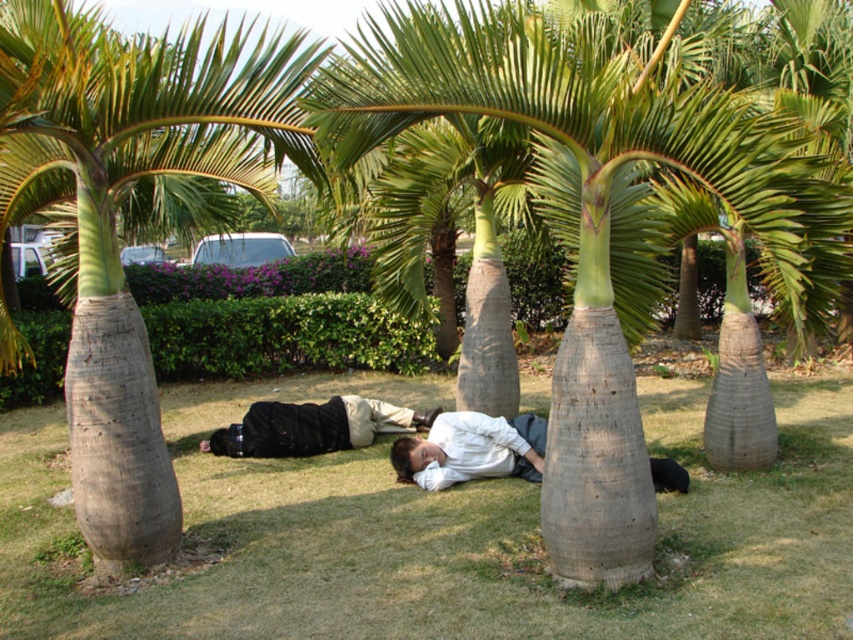
Describe the element at coordinates (590, 212) in the screenshot. I see `smooth gray trunk at center` at that location.

Is point (514, 113) positioned before point (252, 108)?

Yes, point (514, 113) is closer to viewer.

Find the location of `smooth gray trunk at center`. smooth gray trunk at center is located at coordinates (590, 212).

Identify the location of smooth gray trunk at center. This screenshot has height=640, width=853. (590, 212).

Can you confirm if green grass at center is taller than smooth gray trunk at center?

No, green grass at center is not taller than smooth gray trunk at center.

Is point (194, 586) positioned behind point (730, 138)?

Yes, it is.

You are a GUI agent. You are given a task and a screenshot of the screen. Output one action in this format:
    pyautogui.click(x=<x>, y=<y>)
    Task: Click on the green grass at center
    This screenshot has width=853, height=640.
    Given the screenshot: What is the action you would take?
    pyautogui.click(x=439, y=532)

Is smooth gray trunk at left shorter than black matte shirt at center?

In fact, smooth gray trunk at left may be taller than black matte shirt at center.

Which is behind, point (13, 218) or point (283, 433)?

The point (283, 433) is more distant.

This screenshot has width=853, height=640. Identify the location of smooth gray trunk at left. (114, 216).

Image resolution: width=853 pixels, height=640 pixels. What are the coordinates of `smooth gray trunk at left` in the screenshot? It's located at (114, 216).